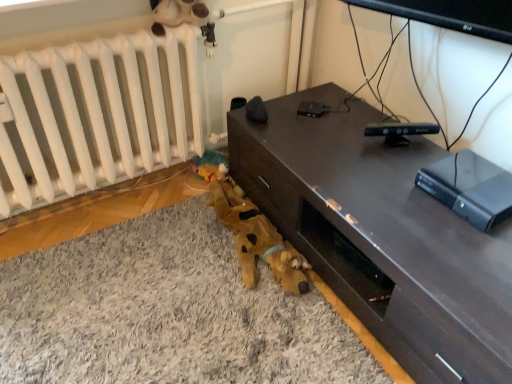
The height and width of the screenshot is (384, 512). What are the coordinates of `free region on the left part of black plastic gaming console at right` in the screenshot? It's located at (398, 196).